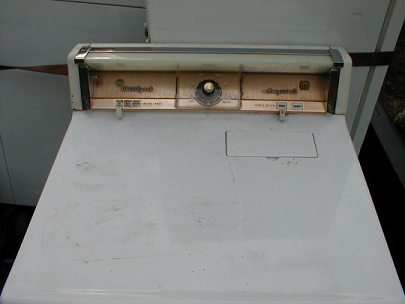
At what (x,y) coordinates should I click in order to perform the action: click on box. Please return your answer as a coordinate pair (x, y). Looking at the image, I should click on (300, 151).